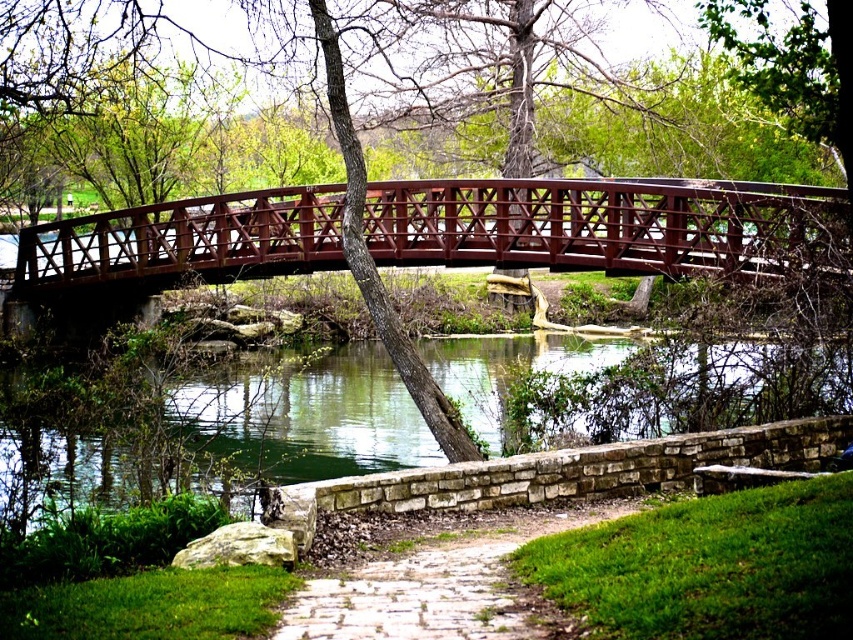
You are a landscape architect designing a new park. You want to place a bench exactly halfway between the metallic red bridge at center and the white stone path at center. How far will the bench be from each object?

The bench will be 8.765 meters away from both the metallic red bridge at center and the white stone path at center since the distance between them is 17.53 meters, and halfway would be half of that distance.

You are a bird flying over the park and want to land on either the metallic red bridge at center or the green water at lower center. Which surface would you choose if you prefer a higher elevation?

The metallic red bridge at center is taller than the green water at lower center, so you should choose the metallic red bridge at center for a higher elevation.